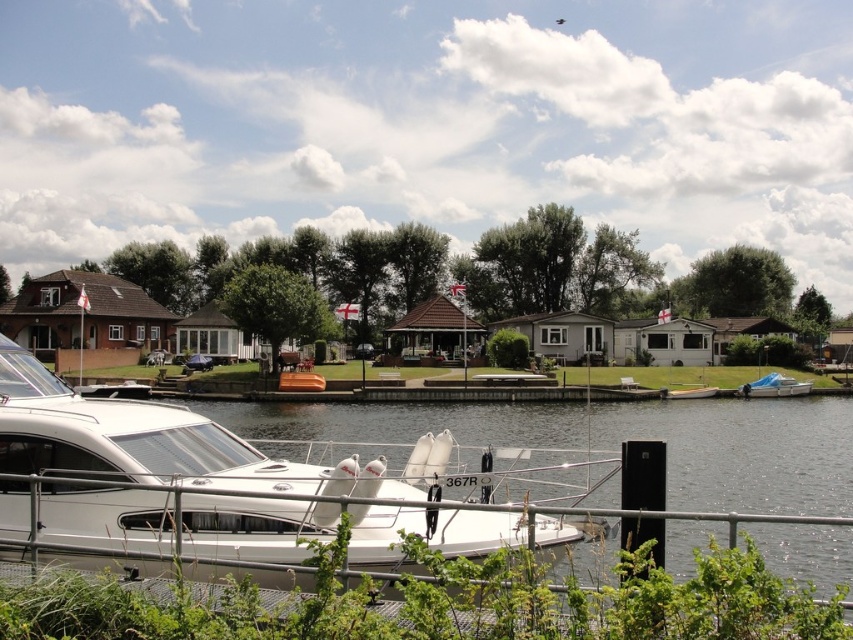
Does point (148, 440) come in front of point (717, 388)?

Yes, it is in front of point (717, 388).

This screenshot has width=853, height=640. I want to click on white glossy boat at center, so click(215, 484).

Is the position of white glossy boat at center less distant than that of brown wooden boat at center?

That is True.

Is white glossy boat at center positioned at the back of brown wooden boat at center?

That is False.

Which is in front, point (154, 529) or point (297, 376)?

Point (154, 529)

You are a GUI agent. You are given a task and a screenshot of the screen. Output one action in this format:
    pyautogui.click(x=<x>, y=<y>)
    Task: Click on the white glossy boat at center
    
    Given the screenshot: What is the action you would take?
    pyautogui.click(x=215, y=484)

This screenshot has height=640, width=853. Describe the element at coordinates (775, 387) in the screenshot. I see `white plastic boat at lower right` at that location.

Is point (764, 388) farther from camera compared to point (701, 387)?

That is False.

Does point (779, 388) come closer to viewer compared to point (693, 397)?

No, it is behind (693, 397).

This screenshot has width=853, height=640. Identify the location of white plastic boat at lower right. (775, 387).